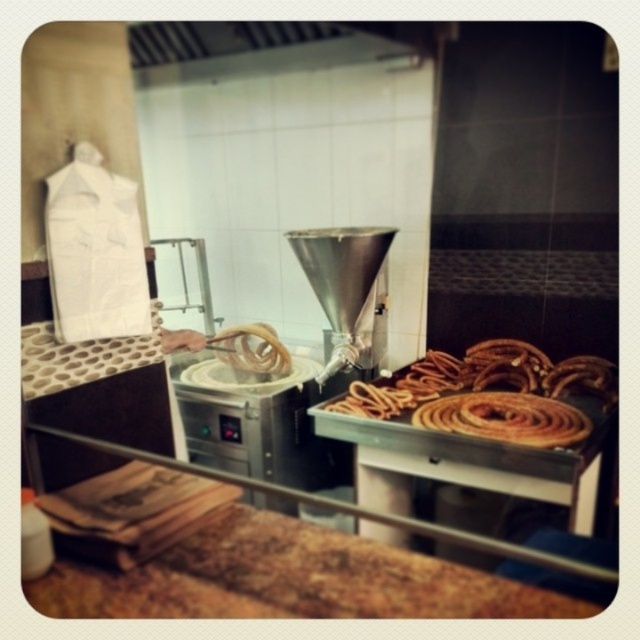
Question: Among these objects, which one is nearest to the camera?

Choices:
 (A) crispy golden churros at center
 (B) brown crispy pastry at right

Answer: (B)

Question: Does crispy golden churros at center lie in front of brown crispy pastry at right?

Choices:
 (A) yes
 (B) no

Answer: (B)

Question: Does crispy golden churros at center come behind brown crispy pastry at right?

Choices:
 (A) yes
 (B) no

Answer: (A)

Question: Which point is closer to the camera taking this photo?

Choices:
 (A) (476, 417)
 (B) (460, 392)

Answer: (A)

Question: Can you confirm if crispy golden churros at center is smaller than brown crispy pastry at right?

Choices:
 (A) yes
 (B) no

Answer: (B)